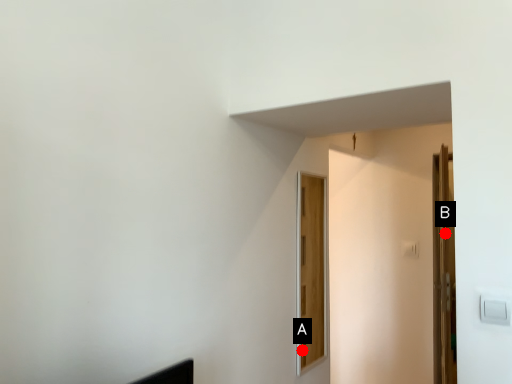
Question: Two points are circled on the image, labeled by A and B beside each circle. Which of the following is the closest to the observer?

Choices:
 (A) A is closer
 (B) B is closer

Answer: (B)